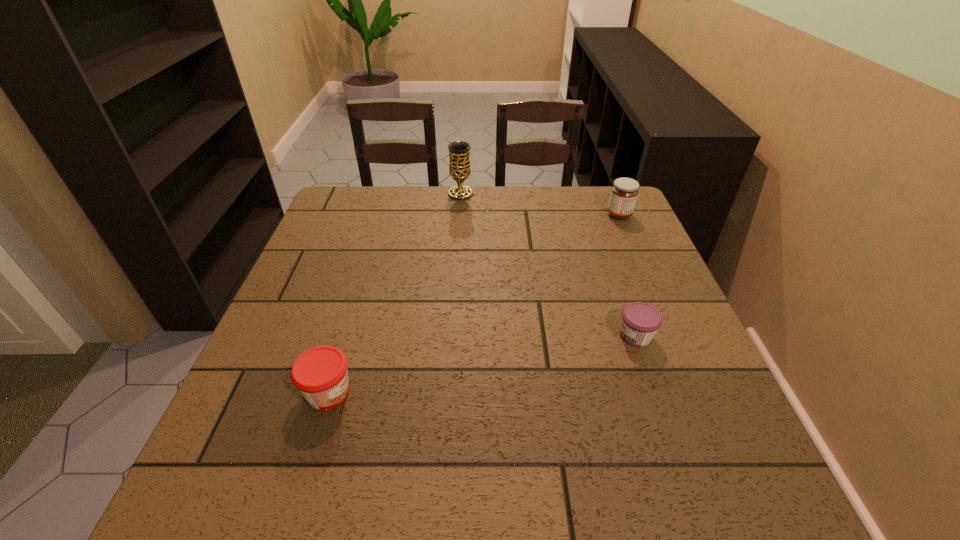
In the image, there is a desktop. Where is `free space at the left edge`? Image resolution: width=960 pixels, height=540 pixels. free space at the left edge is located at coordinates (334, 329).

In the image, there is a desktop. At what (x,y) coordinates should I click in order to perform the action: click on vacant space at the right edge. Please return your answer as a coordinate pair (x, y). The width and height of the screenshot is (960, 540). Looking at the image, I should click on (624, 348).

In the image, there is a desktop. Find the location of `free space at the far left corner`. free space at the far left corner is located at coordinates (359, 217).

Locate an element on the screen. The height and width of the screenshot is (540, 960). vacant space at the near left corner of the desktop is located at coordinates (235, 474).

In the image, there is a desktop. Where is `vacant area at the near right corner`? This screenshot has width=960, height=540. vacant area at the near right corner is located at coordinates (688, 498).

This screenshot has width=960, height=540. I want to click on vacant area that lies between the second farthest jam and the third object from right to left, so click(548, 265).

I want to click on unoccupied area between the shortest jam and the farthest object, so click(x=548, y=265).

I want to click on free space between the leftmost jam and the tallest object, so click(x=395, y=293).

This screenshot has height=540, width=960. Identify the location of vacant space in between the farthest object and the second shortest jam. (395, 293).

I want to click on free space between the chalice and the tallest jam, so click(x=540, y=204).